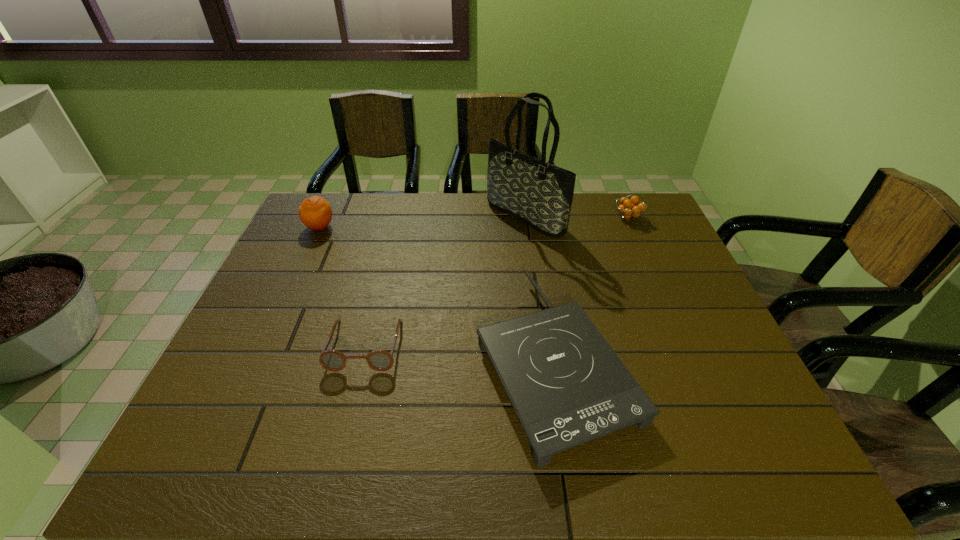
Find the location of `tote bag`. tote bag is located at coordinates point(540,194).

At what (x,y) coordinates should I click in order to perform the action: click on the leftmost object. Please return your answer as a coordinate pair (x, y). Image resolution: width=960 pixels, height=540 pixels. Looking at the image, I should click on (315, 212).

The width and height of the screenshot is (960, 540). Identify the location of the left orange fruit. (315, 212).

The width and height of the screenshot is (960, 540). I want to click on the right orange fruit, so click(630, 209).

Locate an element on the screen. This screenshot has width=960, height=540. the rightmost object is located at coordinates (630, 209).

Where is `the fourth object from right to left`? The image size is (960, 540). the fourth object from right to left is located at coordinates (379, 360).

The width and height of the screenshot is (960, 540). What are the coordinates of `hotplate` in the screenshot? It's located at (567, 386).

This screenshot has width=960, height=540. Find the location of `vacant space located on the right of the tallest object`. vacant space located on the right of the tallest object is located at coordinates (651, 217).

What are the coordinates of `free point located 0.290m on the front of the leftmost object` in the screenshot? It's located at (285, 301).

Identify the location of vacant region located on the left of the shorter orange fruit. (505, 217).